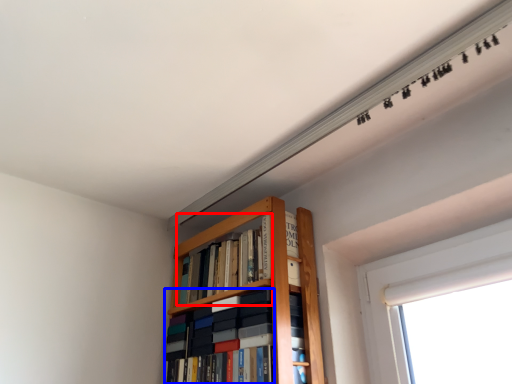
Question: Among these objects, which one is farthest to the camera, book (highlighted by a red box) or book (highlighted by a blue box)?

Choices:
 (A) book
 (B) book

Answer: (A)